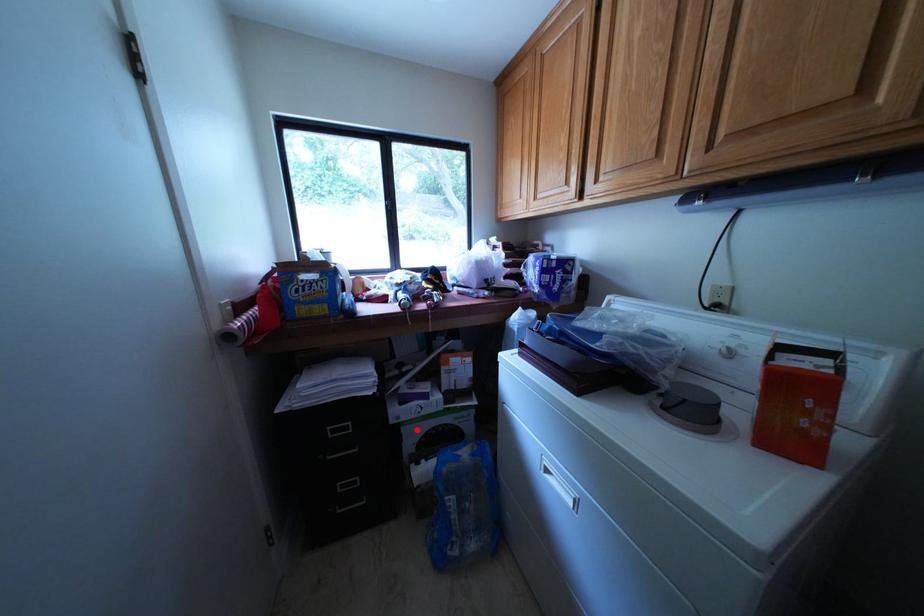
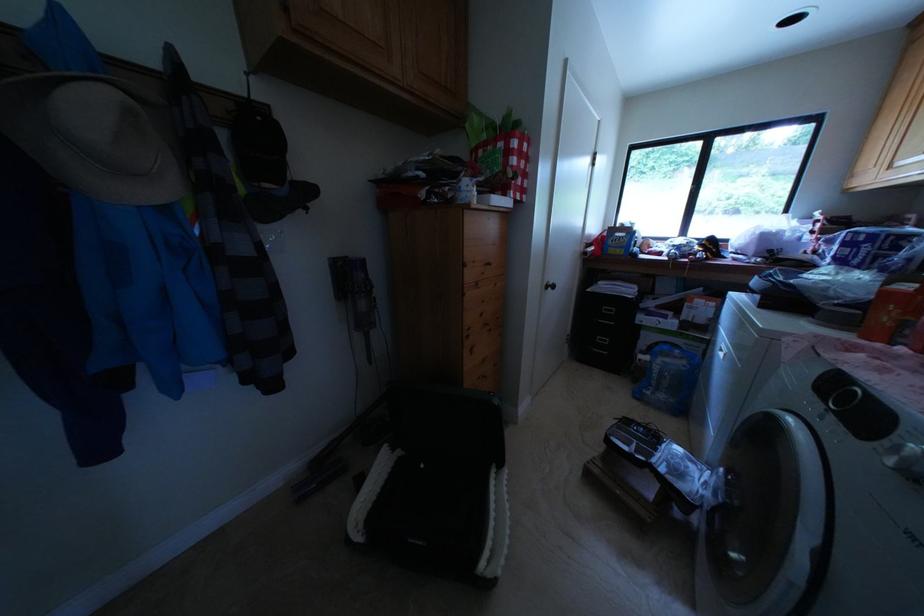
The point at the highlighted location is marked in the first image. Where is the corresponding point in the second image?

(655, 333)